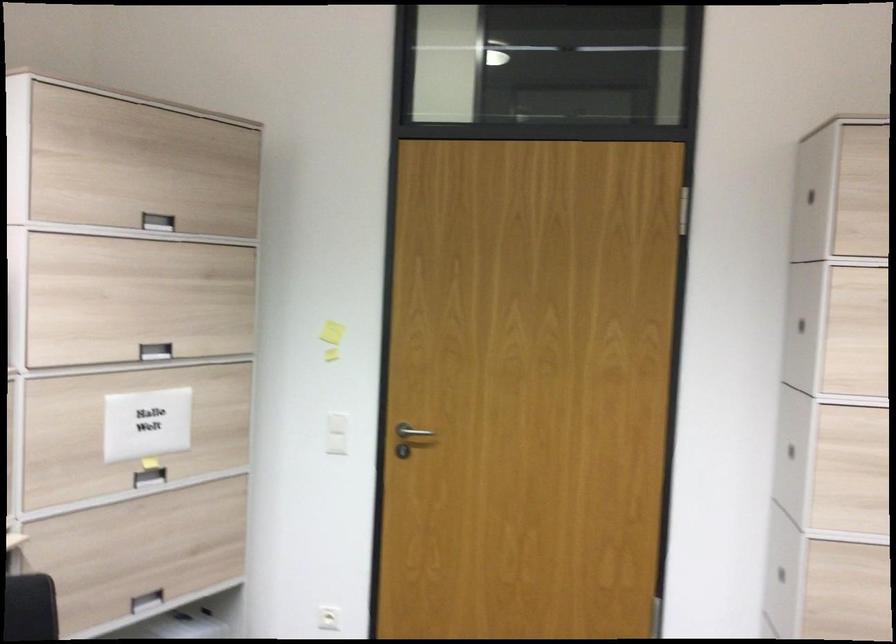
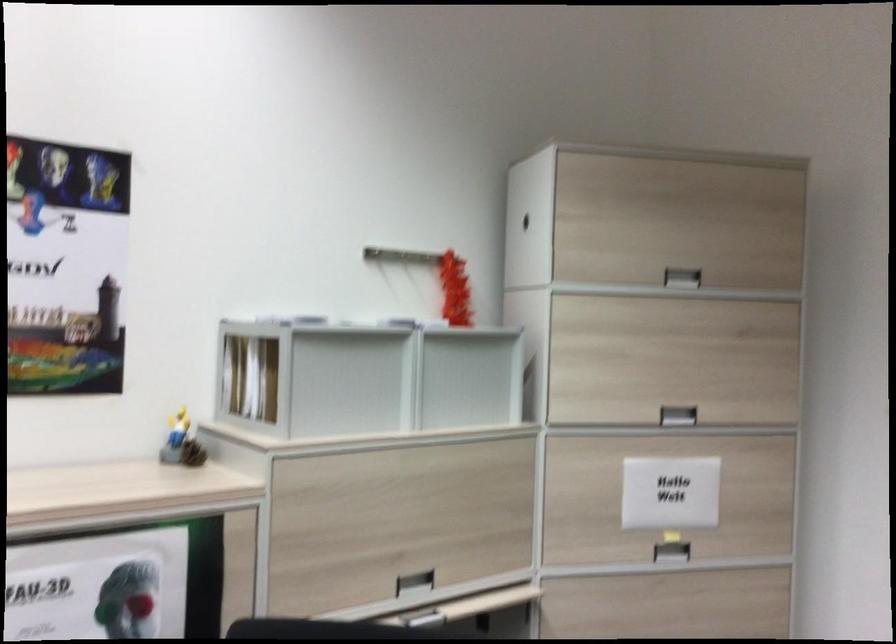
The point at (x=151, y=223) is marked in the first image. Where is the corresponding point in the second image?

(682, 277)